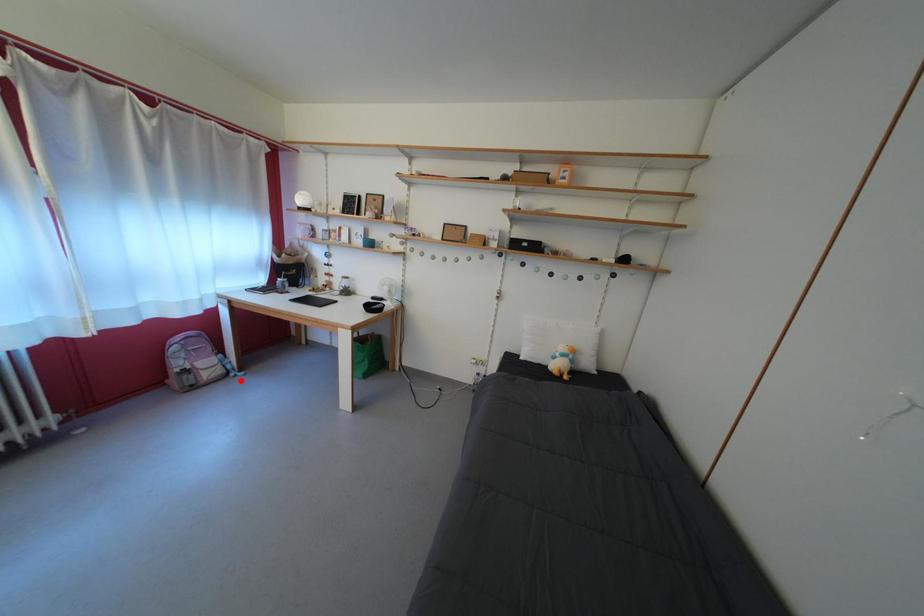
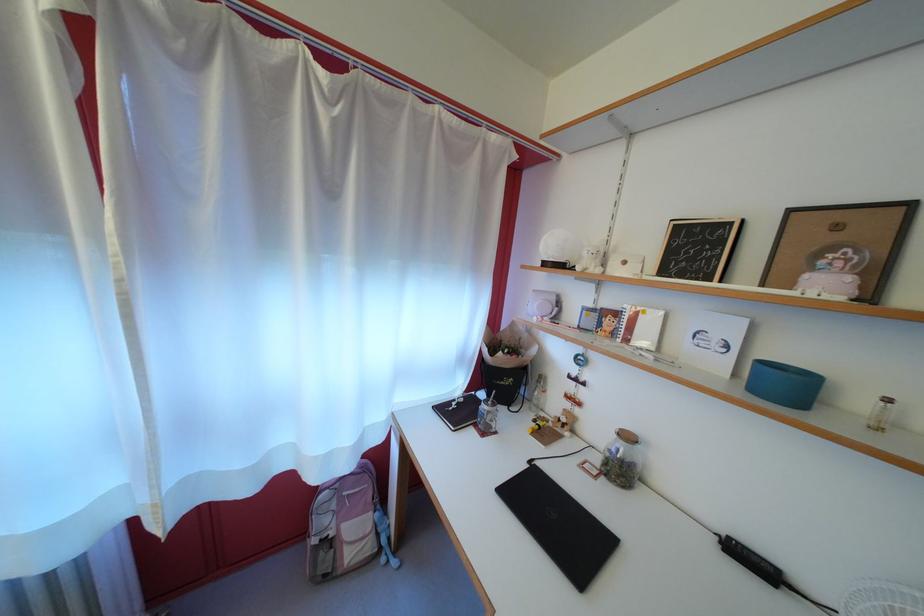
Question: I am providing you with two images of the same scene from different viewpoints. Image1 has a red point marked. In image2, the corresponding 3D location appears at what relative position? Reply with the corresponding letter.

Choices:
 (A) Closer
 (B) Farther

Answer: (B)